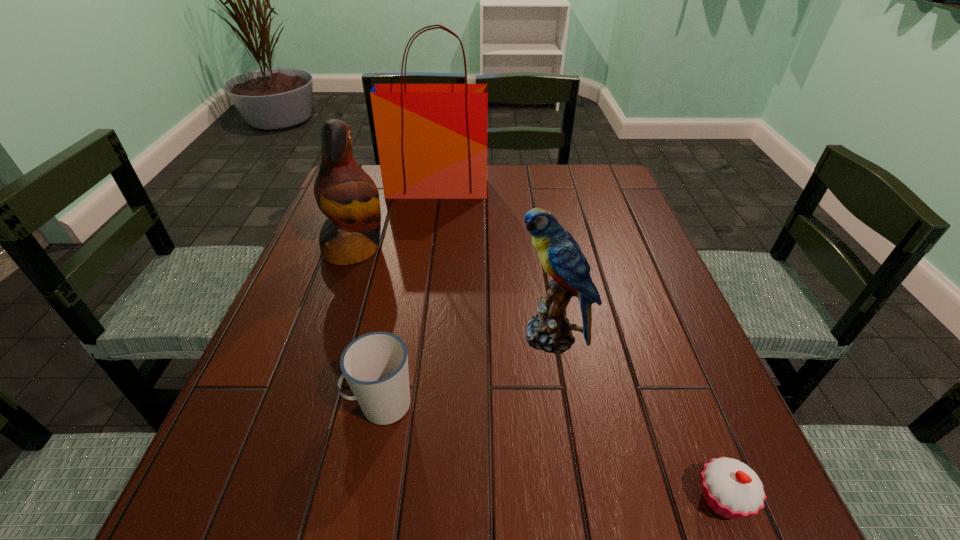
The width and height of the screenshot is (960, 540). Identify the location of the third closest object to the nearer parrot. (348, 197).

At what (x,y) coordinates should I click in order to perform the action: click on free space that satisfies the following two spatial constraints: 1. with a handle on the side of the fourth tallest object; 2. on the right side of the nearest object. Please return your answer as a coordinate pair (x, y). Looking at the image, I should click on (363, 498).

Locate an element on the screen. Image resolution: width=960 pixels, height=540 pixels. free space that satisfies the following two spatial constraints: 1. on the handle side of the tallest object; 2. on the right side of the cupcake is located at coordinates (395, 498).

Find the location of a particular element. This screenshot has width=960, height=540. vacant space that satisfies the following two spatial constraints: 1. on the back side of the shortest object; 2. on the face of the third nearest object is located at coordinates (659, 336).

Find the location of a particular element. free point that satisfies the following two spatial constraints: 1. on the face of the right parrot; 2. on the back side of the nearest object is located at coordinates (576, 498).

The image size is (960, 540). Identify the location of free space that satisfies the following two spatial constraints: 1. on the face of the rightmost object; 2. on the right side of the second object from right to left. (576, 498).

Locate an element on the screen. free space that satisfies the following two spatial constraints: 1. on the back side of the rightmost object; 2. with a handle on the side of the second shortest object is located at coordinates (685, 404).

This screenshot has width=960, height=540. Identify the location of vacant area in the image that satisfies the following two spatial constraints: 1. on the face of the shortest object; 2. on the left side of the farther parrot. (271, 498).

Find the location of a particular element. The width and height of the screenshot is (960, 540). free space that satisfies the following two spatial constraints: 1. on the face of the right parrot; 2. on the right side of the rightmost object is located at coordinates (576, 498).